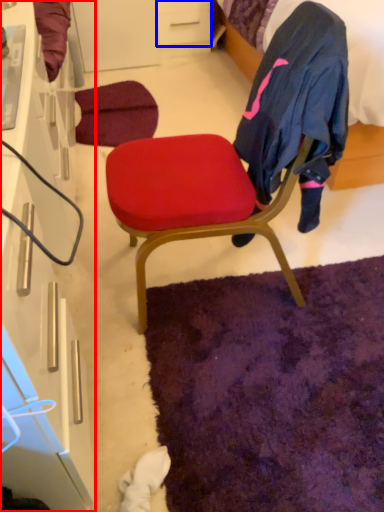
Question: Among these objects, which one is nearest to the camera, cabinetry (highlighted by a red box) or drawer (highlighted by a blue box)?

Choices:
 (A) cabinetry
 (B) drawer

Answer: (A)